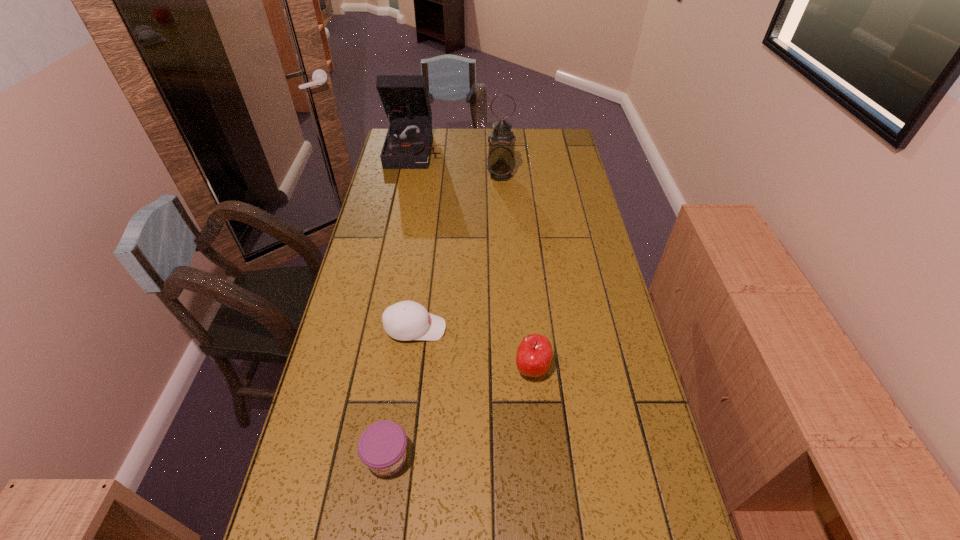
The height and width of the screenshot is (540, 960). Find the location of `vacant space that satisfies the following two spatial constraints: 1. on the front-facing side of the phonograph_record; 2. on the right side of the second nearest object`. vacant space that satisfies the following two spatial constraints: 1. on the front-facing side of the phonograph_record; 2. on the right side of the second nearest object is located at coordinates [x=372, y=369].

Identify the location of free region that satisfies the following two spatial constraints: 1. on the front-facing side of the baseball cap; 2. on the right side of the third tallest object. (410, 369).